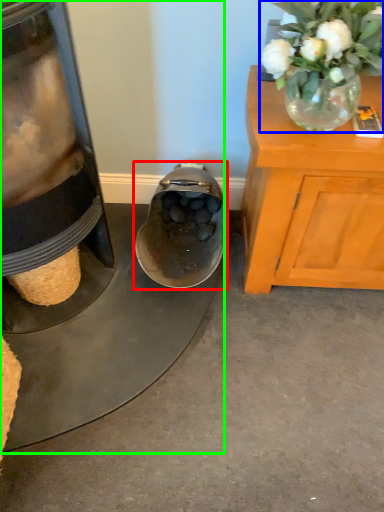
Question: Which is farther away from footwear (highlighted by a red box)? floral arrangement (highlighted by a blue box) or appliance (highlighted by a green box)?

Choices:
 (A) floral arrangement
 (B) appliance

Answer: (A)